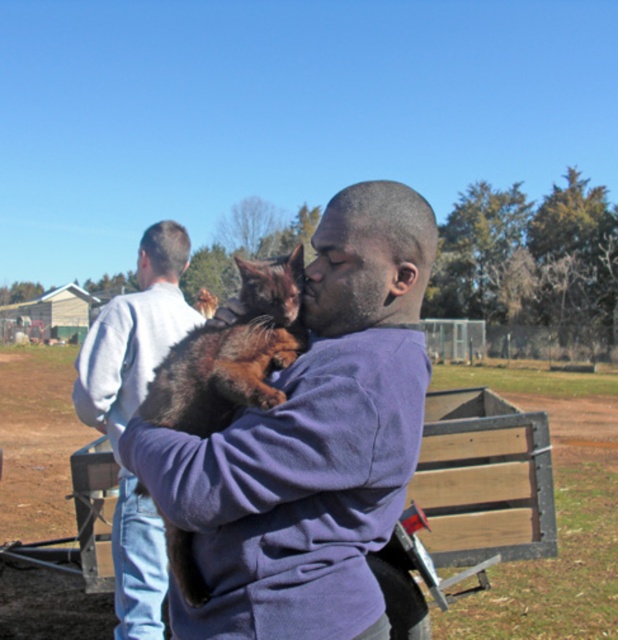
You are a photographer trying to capture a closeup shot of the brown furry cat at center without the light gray sweatshirt at left appearing in the frame. Based on their sizes, can you suggest a way to adjust your camera angle?

Since the brown furry cat at center is larger in size than the light gray sweatshirt at left, you can zoom in on the brown furry cat at center to ensure it fills the frame while the smaller light gray sweatshirt at left may be cropped out of the shot.